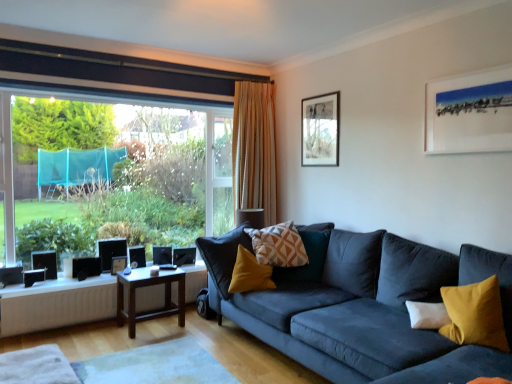
Locate an element on the screen. spots to the right of brown wooden table at center, the 2th table when ordered from top to bottom is located at coordinates (197, 326).